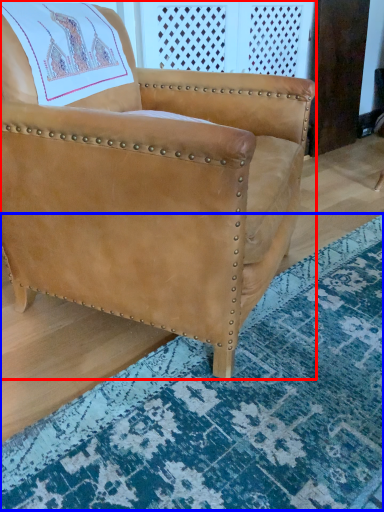
Question: Which of the following is the farthest to the observer, chair (highlighted by a red box) or mat (highlighted by a blue box)?

Choices:
 (A) chair
 (B) mat

Answer: (A)